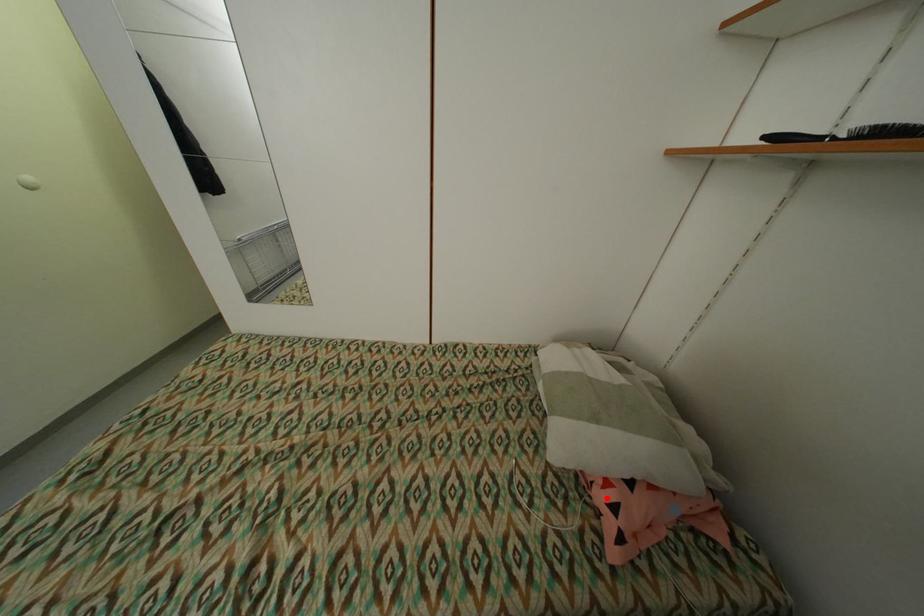
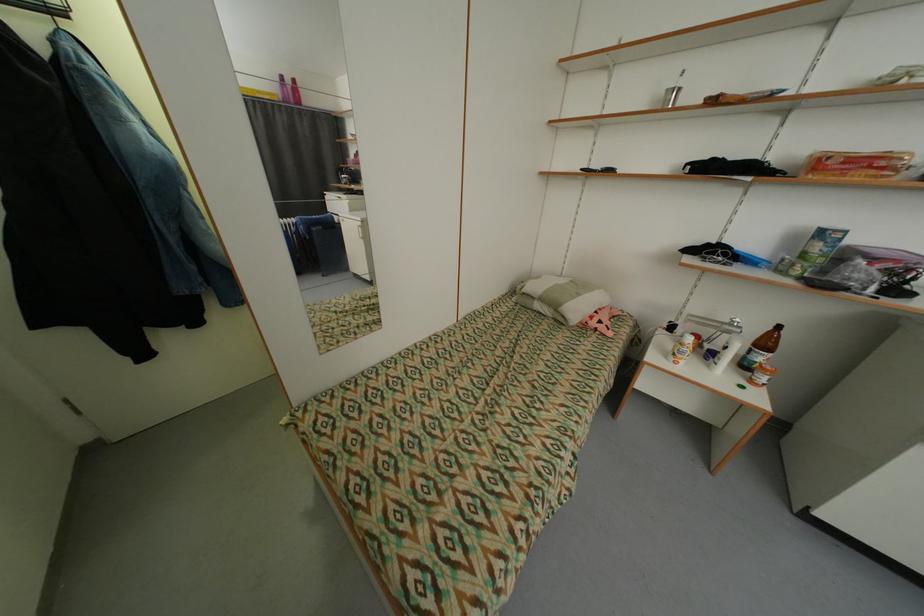
Find the pixel in the second image that matches the highlighted location in the first image.

(600, 323)